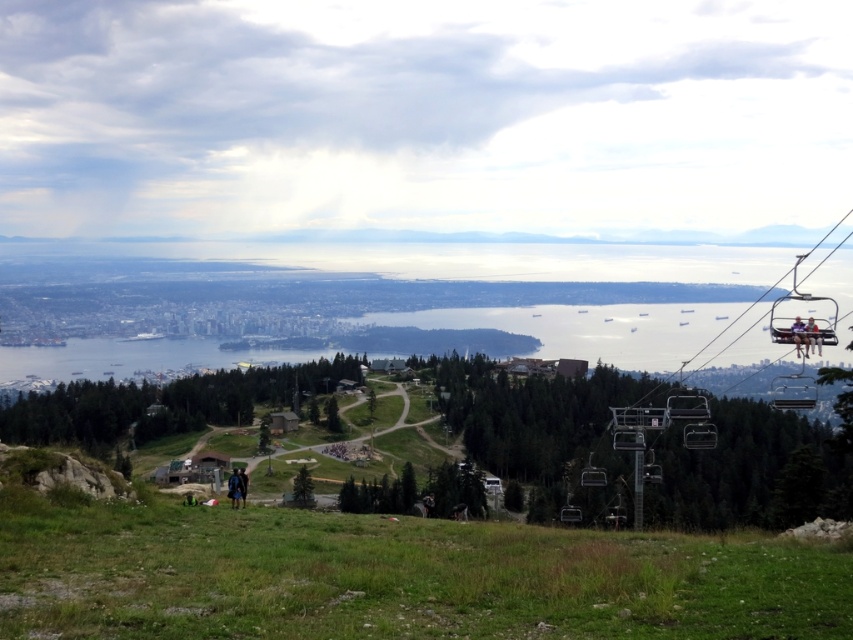
Does point (813, 298) come behind point (238, 504)?

Yes, point (813, 298) is behind point (238, 504).

What are the coordinates of `metallic silver ski lift at right` in the screenshot? It's located at (753, 307).

Can you confirm if blue denim jacket at upper right is bigger than matte black chairlift at lower center?

Indeed, blue denim jacket at upper right has a larger size compared to matte black chairlift at lower center.

Which is above, blue denim jacket at upper right or matte black chairlift at lower center?

blue denim jacket at upper right

Where is `blue denim jacket at upper right`? The height and width of the screenshot is (640, 853). blue denim jacket at upper right is located at coordinates (799, 336).

Is the position of light brown wooden chair at right more distant than that of blue denim jacket at upper right?

Yes, light brown wooden chair at right is further from the viewer.

Is point (807, 342) positioned in front of point (802, 324)?

No, (807, 342) is further to viewer.

Image resolution: width=853 pixels, height=640 pixels. I want to click on light brown wooden chair at right, so coord(811,337).